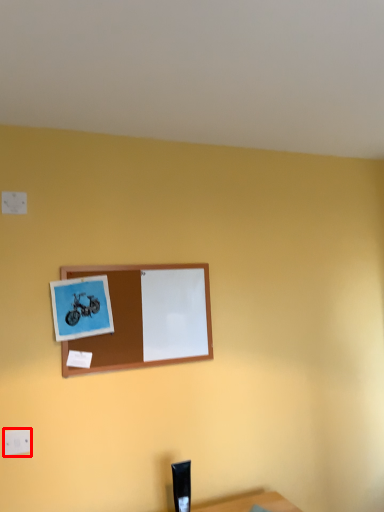
Question: From the image's perspective, what is the correct spatial relationship of electric outlet (annotated by the red box) in relation to picture frame?

Choices:
 (A) below
 (B) above

Answer: (A)